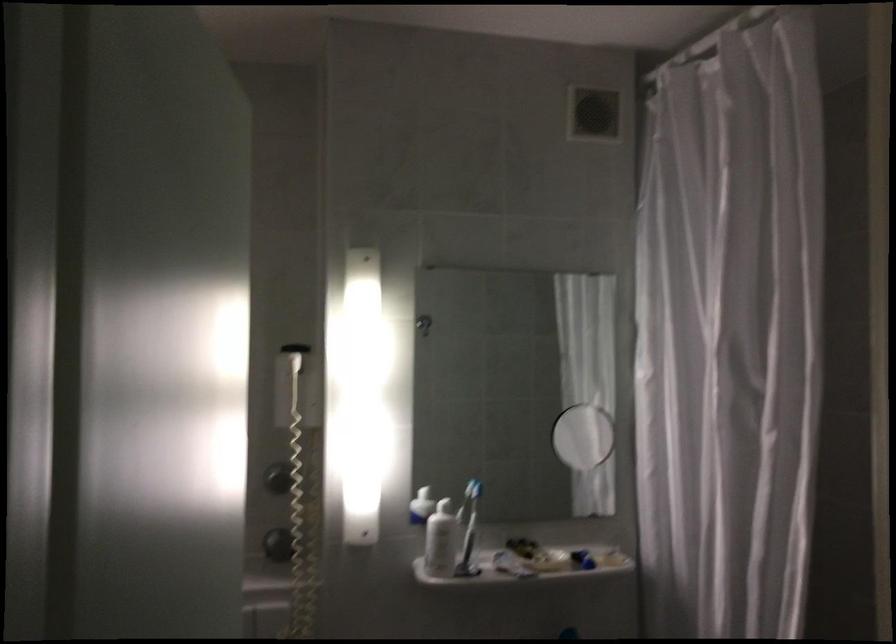
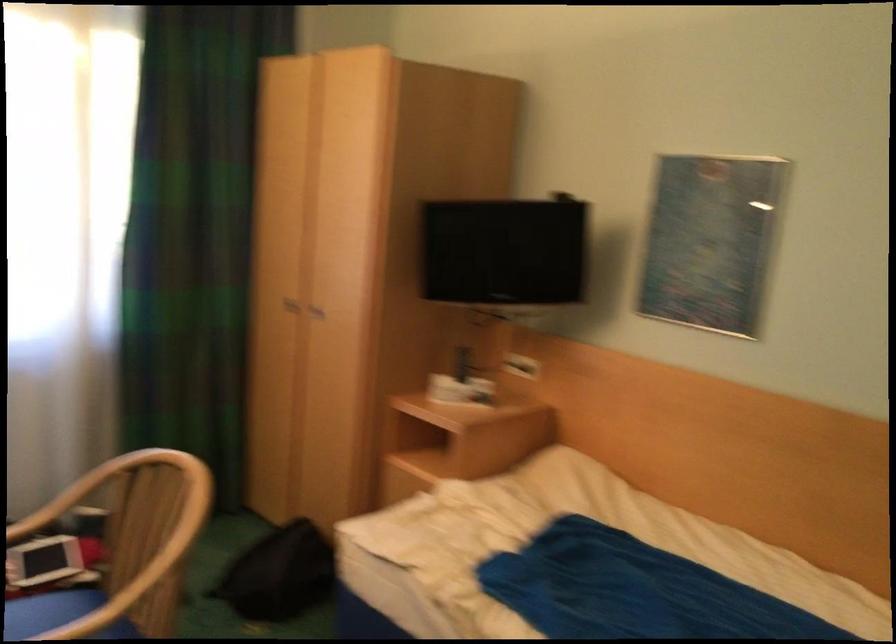
Question: Based on the continuous images, in which direction is the camera rotating? Reply with the corresponding letter.

Choices:
 (A) Left
 (B) Right
 (C) Up
 (D) Down

Answer: (A)